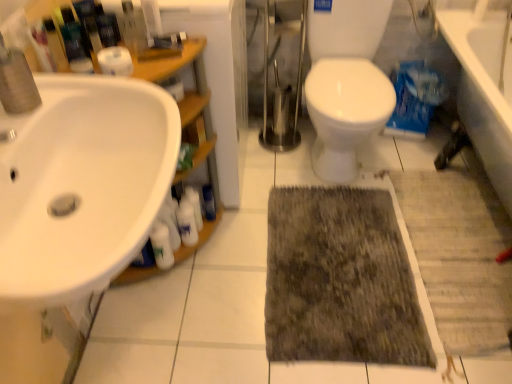
The height and width of the screenshot is (384, 512). In order to click on vacant space that's between white glossy bottle at lower left, acting as the 1th cleaning product starting from the right, and dark gray shaggy rug at center in this screenshot , I will do `click(240, 256)`.